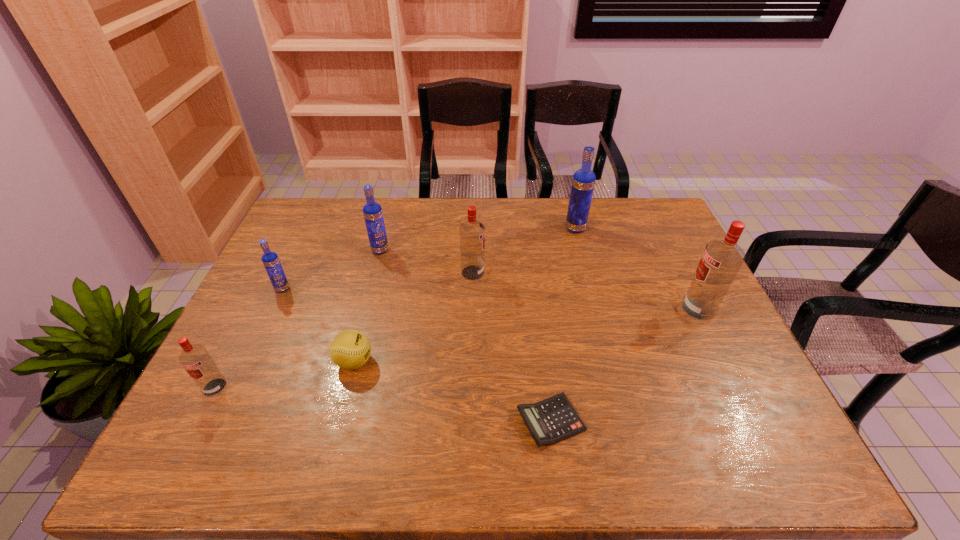
Identify the location of free location located on the left of the second farthest object. The height and width of the screenshot is (540, 960). (280, 250).

Image resolution: width=960 pixels, height=540 pixels. I want to click on vacant area located on the front label of the third farthest vodka, so click(514, 273).

Locate an element on the screen. vacant area located 0.400m on the right of the fifth vodka from right to left is located at coordinates (423, 288).

Locate an element on the screen. This screenshot has height=540, width=960. free space located on the front label of the nearest vodka is located at coordinates (190, 437).

I want to click on vacant space located 0.260m on the logo side of the softball, so click(475, 362).

Find the location of a particular element. The height and width of the screenshot is (540, 960). blank space located 0.400m on the left of the calculator is located at coordinates (340, 422).

In order to click on object located at the far edge in this screenshot , I will do `click(583, 181)`.

Identify the location of object situated at the near edge. (550, 421).

Identify the location of object located in the right edge section of the desktop. This screenshot has height=540, width=960. (721, 260).

In the image, there is a desktop. Identify the location of vacant region at the far edge. (348, 208).